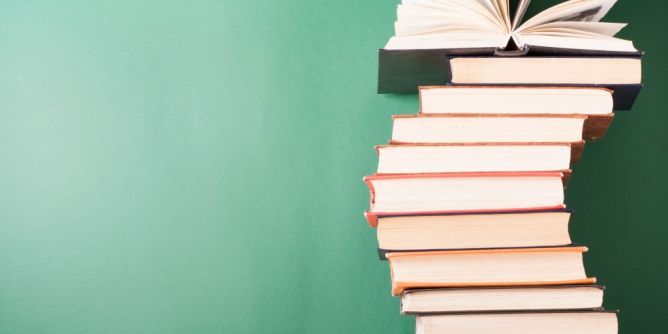
The image size is (668, 334). What are the coordinates of `book` in the screenshot? It's located at (479, 19), (534, 79), (526, 100), (502, 132), (474, 161), (443, 197), (436, 235), (409, 271), (424, 307), (446, 332).